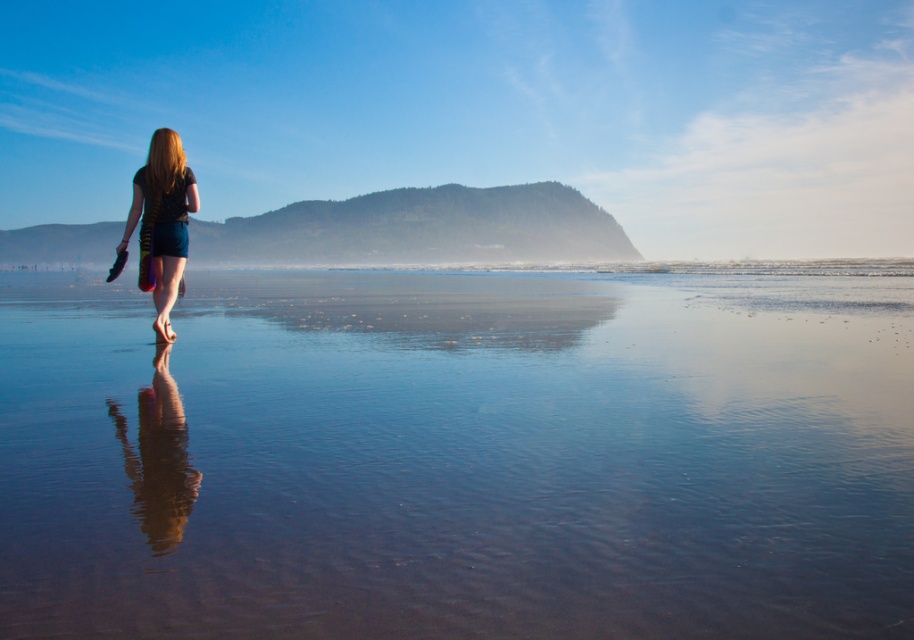
Between point (824, 332) and point (158, 237), which one is positioned in front?

Point (158, 237) is in front.

Between clear water at center and matte black shorts at center, which one appears on the right side from the viewer's perspective?

From the viewer's perspective, clear water at center appears more on the right side.

Find the location of a particular element. The height and width of the screenshot is (640, 914). clear water at center is located at coordinates (458, 456).

This screenshot has width=914, height=640. Find the location of `clear water at center`. clear water at center is located at coordinates click(x=458, y=456).